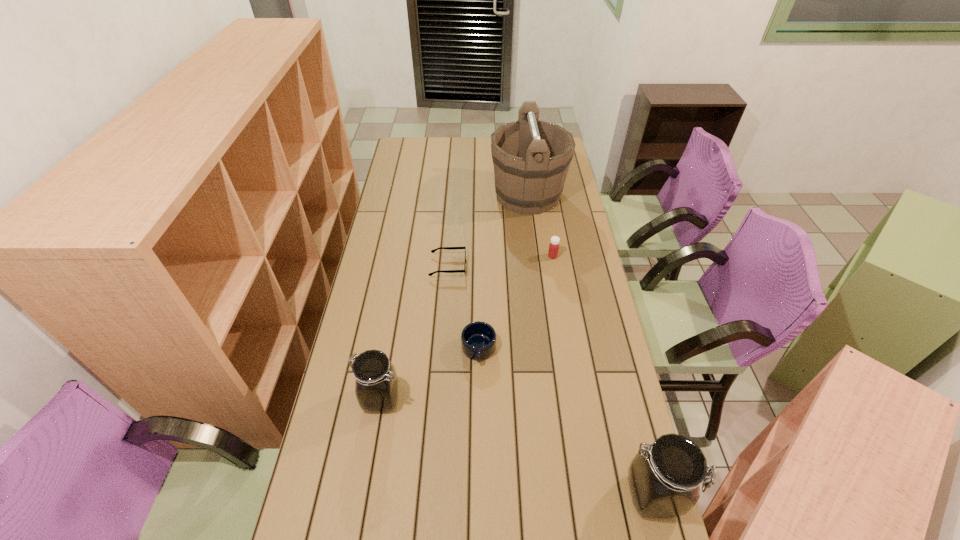
I want to click on the fourth shortest object, so click(x=376, y=386).

Image resolution: width=960 pixels, height=540 pixels. What are the coordinates of `the left jar` in the screenshot? It's located at (376, 386).

Locate an element on the screen. the right jar is located at coordinates (664, 479).

The image size is (960, 540). Identify the location of the nearest object. (664, 479).

Locate an element on the screen. The height and width of the screenshot is (540, 960). the third shortest object is located at coordinates (553, 250).

You are a GUI agent. You are given a task and a screenshot of the screen. Output one action in this format:
    pyautogui.click(x=<x>, y=<y>)
    Task: Click on the mug
    The image size is (960, 540).
    Given the screenshot: What is the action you would take?
    coord(478,339)

Find the location of a particular element. This screenshot has width=960, height=540. the second shortest object is located at coordinates (478, 339).

You are a GUI agent. You are given a task and a screenshot of the screen. Output one action in this format:
    pyautogui.click(x=<x>, y=<y>)
    Task: Click on the tallest object
    This screenshot has height=540, width=960.
    Given the screenshot: What is the action you would take?
    pyautogui.click(x=531, y=158)

I want to click on bucket, so click(x=531, y=158).

Find the location of `the shortest object`. the shortest object is located at coordinates (449, 248).